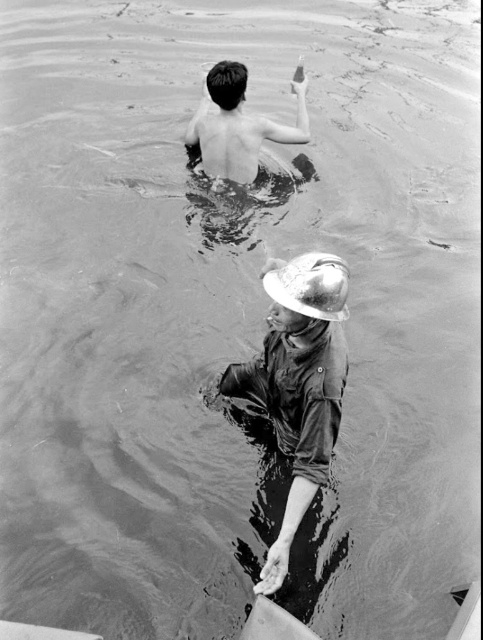
You are a drone operator trying to capture a photo of two people in the water. The first person is at point (296, 308) and the second person is at point (209, 132). To ensure both are visible in the frame, which person should you position the drone closer to?

You should position the drone closer to the person at point (209, 132) because point (296, 308) is in front of point (209, 132). This way, the drone can capture both individuals without one blocking the other.

You are a safety inspector reviewing the photograph. You notice the shiny metallic helmet at center and the shiny skin at upper center. Which object is narrower in width?

The shiny metallic helmet at center is thinner than the shiny skin at upper center, so the shiny metallic helmet at center is narrower in width.

You are a safety inspector reviewing this image. You notice the shiny metallic helmet at center and the shiny skin at upper center. Which object takes up more area in the image?

The shiny skin at upper center occupies more space than the shiny metallic helmet at center.